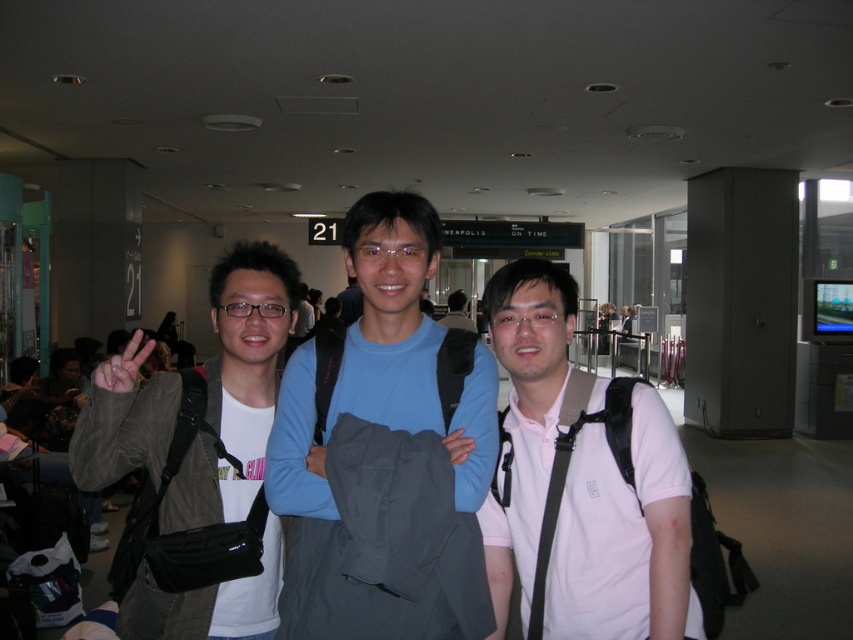
Measure the distance between point (224, 560) and camera.

Point (224, 560) and camera are 1.43 meters apart.

Which is in front, point (178, 404) or point (543, 497)?

Point (543, 497) is in front.

Describe the element at coordinates (196, 464) in the screenshot. I see `matte black jacket at left` at that location.

Identify the location of matte black jacket at left. (196, 464).

Who is positioned more to the left, blue cotton shirt at center or white matte shirt at center?

From the viewer's perspective, blue cotton shirt at center appears more on the left side.

Between blue cotton shirt at center and white matte shirt at center, which one has more height?

Standing taller between the two is blue cotton shirt at center.

Is point (459, 412) positioned after point (526, 620)?

No, (459, 412) is closer to viewer.

Identify the location of blue cotton shirt at center. (384, 451).

In the scene shown: Between blue cotton shirt at center and matte black jacket at left, which one is positioned lower?

matte black jacket at left is lower down.

Which is above, blue cotton shirt at center or matte black jacket at left?

blue cotton shirt at center

Is point (486, 458) farther from viewer compared to point (287, 268)?

No, (486, 458) is closer to viewer.

Find the location of a particular element. The width and height of the screenshot is (853, 640). blue cotton shirt at center is located at coordinates (384, 451).